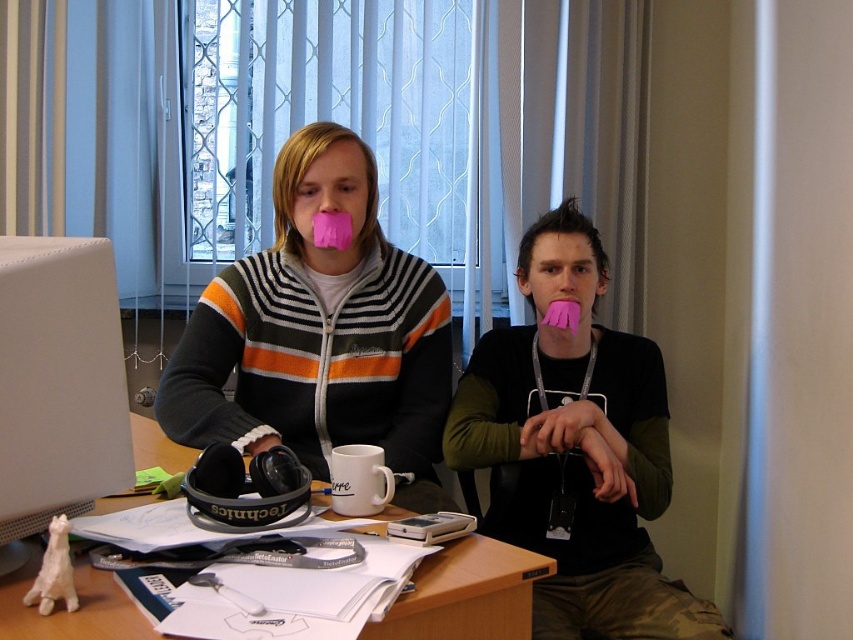
Question: Does matte black hoodie at center appear over wooden desk at center?

Choices:
 (A) no
 (B) yes

Answer: (B)

Question: Estimate the real-world distances between objects in this image. Which object is farther from the wooden desk at center?

Choices:
 (A) matte black shirt at center
 (B) white matte desktop computer at left

Answer: (A)

Question: Among these objects, which one is farthest from the camera?

Choices:
 (A) matte black shirt at center
 (B) wooden desk at center
 (C) matte black hoodie at center

Answer: (C)

Question: Is matte black hoodie at center smaller than wooden desk at center?

Choices:
 (A) no
 (B) yes

Answer: (A)

Question: Which of these objects is positioned farthest from the wooden desk at center?

Choices:
 (A) white matte desktop computer at left
 (B) matte black shirt at center

Answer: (B)

Question: Is matte black shirt at center positioned behind white matte desktop computer at left?

Choices:
 (A) no
 (B) yes

Answer: (B)